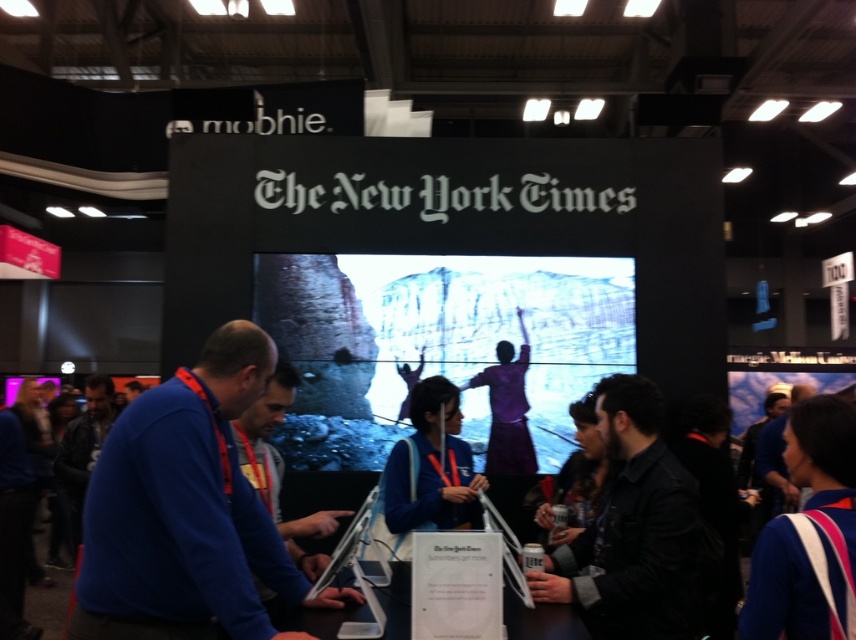
Does dark gray shirt at center appear under blue sweater at center?

Incorrect, dark gray shirt at center is not positioned below blue sweater at center.

Is dark gray shirt at center bigger than blue sweater at center?

No.

This screenshot has height=640, width=856. Describe the element at coordinates (633, 531) in the screenshot. I see `dark gray shirt at center` at that location.

This screenshot has width=856, height=640. In order to click on dark gray shirt at center in this screenshot , I will do `click(633, 531)`.

Between point (176, 472) and point (81, 424), which one is positioned in front?

Point (176, 472) is in front.

Can you confirm if blue matte sweater at center is bigger than leather jacket at left?

No.

Is point (104, 582) closer to viewer compared to point (104, 392)?

Yes, point (104, 582) is closer to viewer.

This screenshot has height=640, width=856. In order to click on blue matte sweater at center in this screenshot , I will do `click(186, 512)`.

Identify the location of blue matte sweater at center. This screenshot has height=640, width=856. (186, 512).

Can you confirm if blue matte sweater at center is positioned to the left of dark gray shirt at center?

Correct, you'll find blue matte sweater at center to the left of dark gray shirt at center.

The width and height of the screenshot is (856, 640). What do you see at coordinates (186, 512) in the screenshot?
I see `blue matte sweater at center` at bounding box center [186, 512].

Where is `blue matte sweater at center`? The image size is (856, 640). blue matte sweater at center is located at coordinates (186, 512).